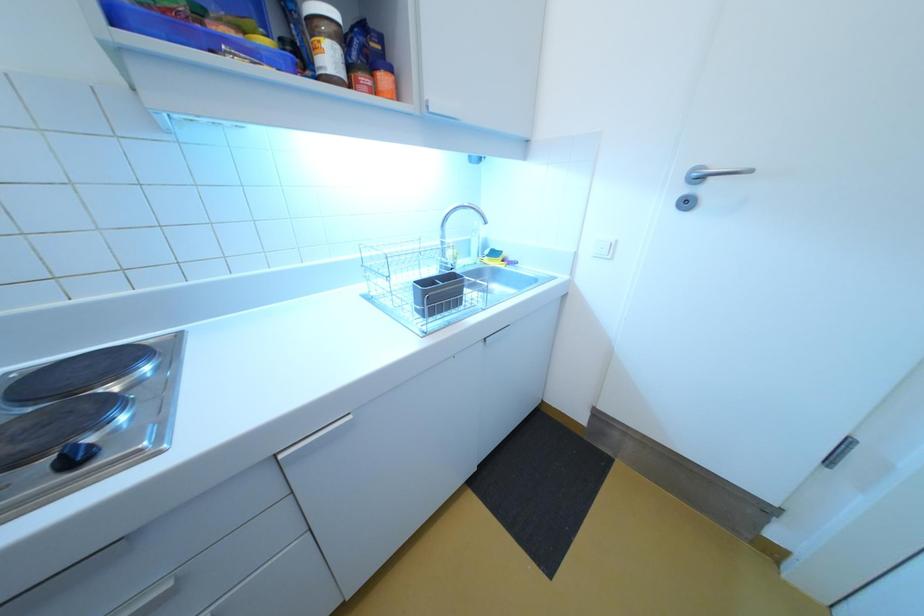
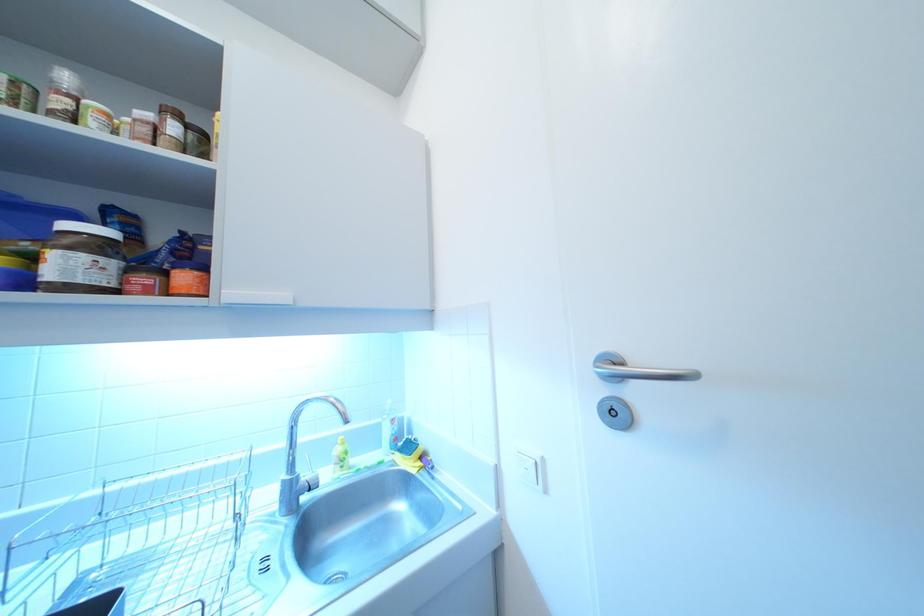
Question: The first image is from the beginning of the video and the second image is from the end. How did the camera likely rotate when shooting the video?

Choices:
 (A) Left
 (B) Right
 (C) Up
 (D) Down

Answer: (C)